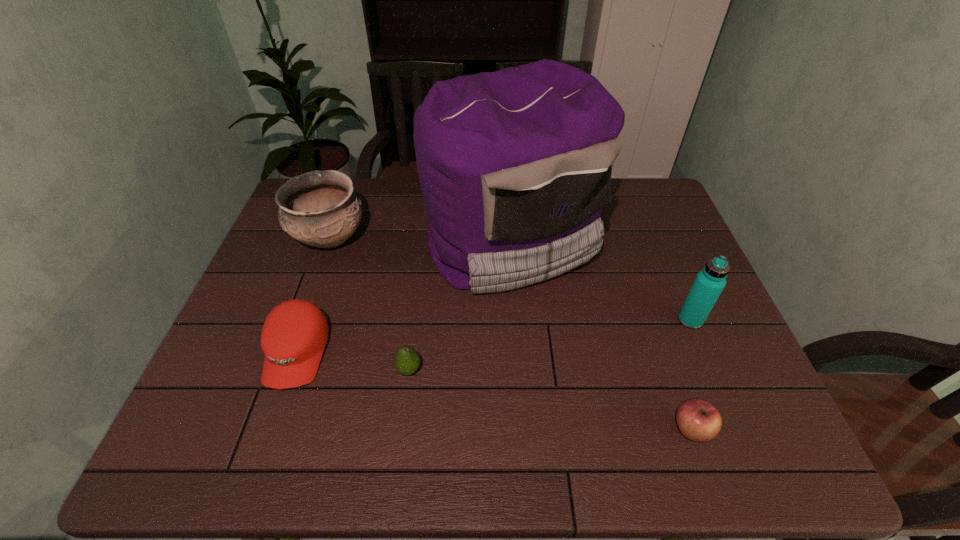
At what (x,y) coordinates should I click in order to perform the action: click on the tallest object. Please return your answer as a coordinate pair (x, y). This screenshot has width=960, height=540. Looking at the image, I should click on (515, 166).

You are a GUI agent. You are given a task and a screenshot of the screen. Output one action in this format:
    pyautogui.click(x=<x>, y=<y>)
    Task: Click on the second tallest object
    
    Given the screenshot: What is the action you would take?
    pyautogui.click(x=709, y=282)

I want to click on water bottle, so click(709, 282).

The width and height of the screenshot is (960, 540). I want to click on pottery, so click(319, 208).

You are a GUI agent. You are given a task and a screenshot of the screen. Output one action in this format:
    pyautogui.click(x=<x>, y=<y>)
    Task: Click on the cap
    
    Given the screenshot: What is the action you would take?
    (x=294, y=335)

Image resolution: width=960 pixels, height=540 pixels. In order to click on apple in this screenshot , I will do `click(698, 420)`.

Locate an element on the screen. The height and width of the screenshot is (540, 960). the fifth object from left to right is located at coordinates (698, 420).

I want to click on avocado, so click(x=406, y=361).

Locate an element on the screen. The image size is (960, 540). free space located on the front pocket of the backpack is located at coordinates (528, 468).

This screenshot has height=540, width=960. In order to click on free location located 0.270m on the left of the fifth shortest object in this screenshot , I will do `click(571, 320)`.